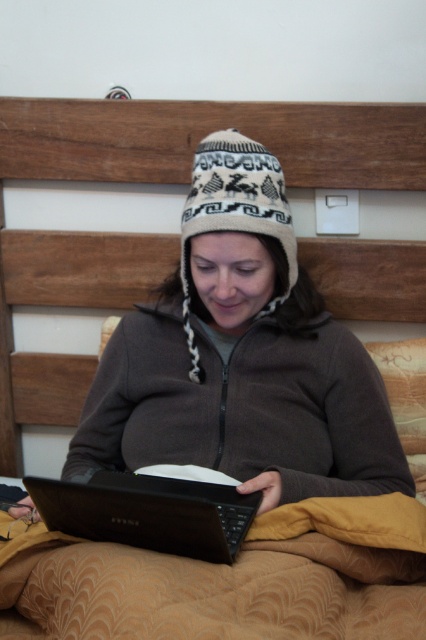
Question: Can you confirm if black matte laptop at center is positioned above white knitted hat at center?

Choices:
 (A) yes
 (B) no

Answer: (B)

Question: Can you confirm if black matte laptop at center is positioned to the left of white knitted hat at center?

Choices:
 (A) no
 (B) yes

Answer: (B)

Question: Which point is closer to the camera?

Choices:
 (A) (198, 161)
 (B) (189, 515)

Answer: (B)

Question: In this image, where is black matte laptop at center located relative to white knitted hat at center?

Choices:
 (A) right
 (B) left

Answer: (B)